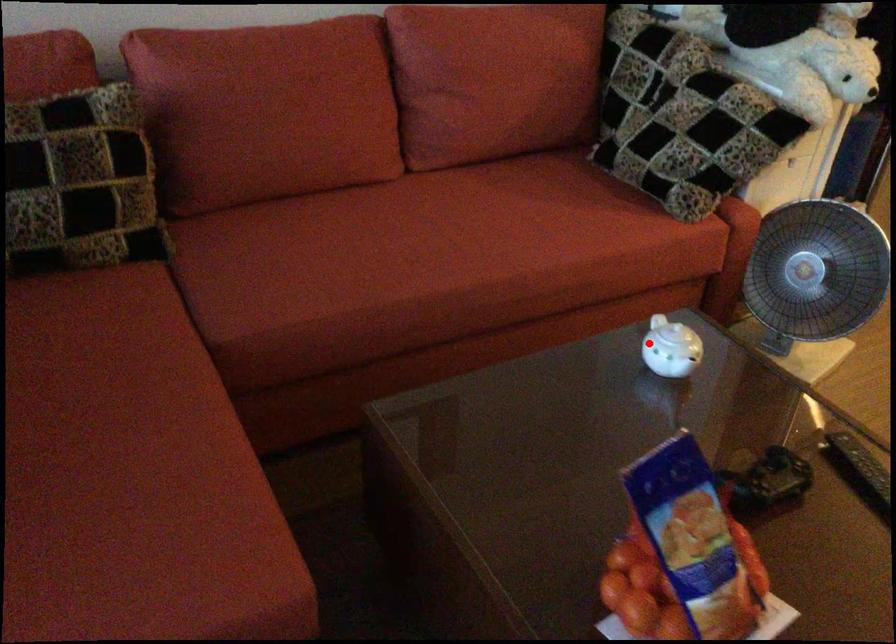
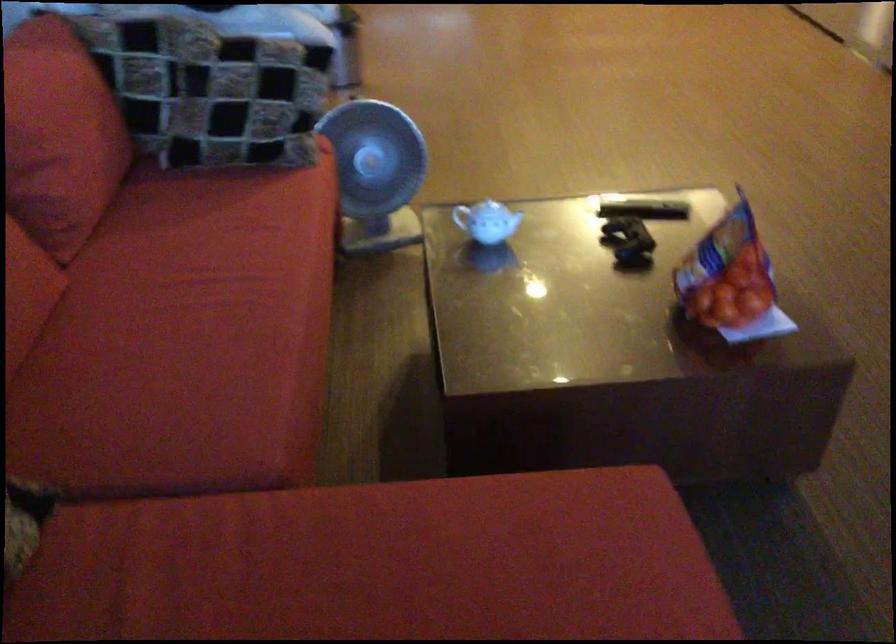
Where in the second image is the point corresponding to the highlighted location from the first image?

(487, 220)